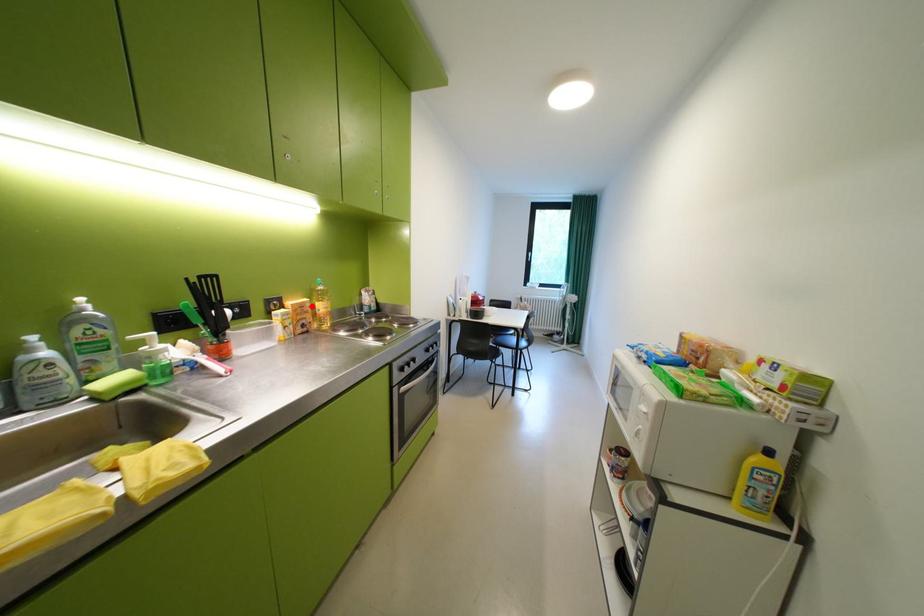
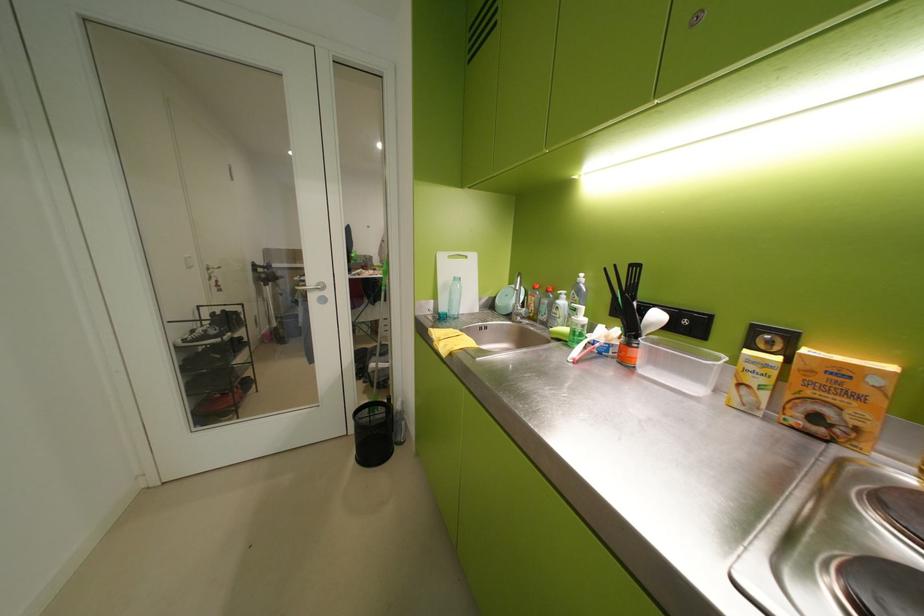
Locate, in the second image, the point that corresponds to the highlighted location in the first image.

(852, 373)